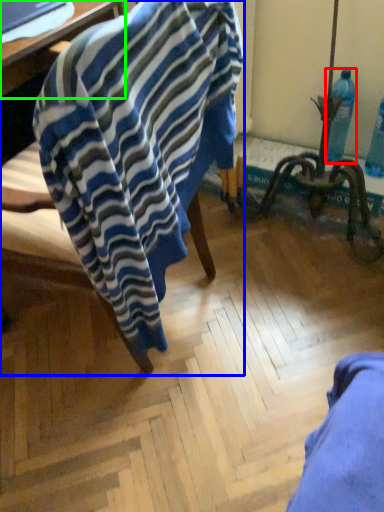
Question: Which is farther away from bottle (highlighted by a red box)? chair (highlighted by a blue box) or table (highlighted by a green box)?

Choices:
 (A) chair
 (B) table

Answer: (B)